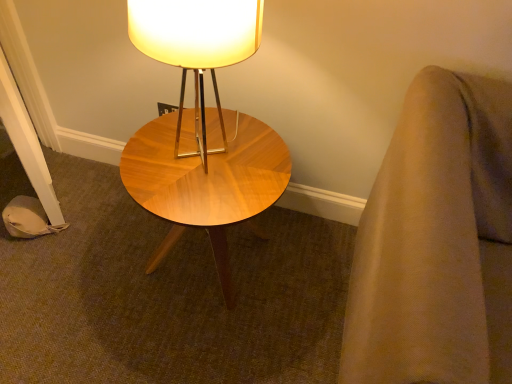
Question: Considering the relative sizes of wooden lampshade at center and woodenwoodencoffee table at center in the image provided, is wooden lampshade at center smaller than woodenwoodencoffee table at center?

Choices:
 (A) yes
 (B) no

Answer: (A)

Question: Is woodenwoodencoffee table at center located within wooden lampshade at center?

Choices:
 (A) yes
 (B) no

Answer: (B)

Question: Considering the relative sizes of wooden lampshade at center and woodenwoodencoffee table at center in the image provided, is wooden lampshade at center shorter than woodenwoodencoffee table at center?

Choices:
 (A) no
 (B) yes

Answer: (A)

Question: Is wooden lampshade at center with woodenwoodencoffee table at center?

Choices:
 (A) no
 (B) yes

Answer: (A)

Question: Is wooden lampshade at center not within woodenwoodencoffee table at center?

Choices:
 (A) yes
 (B) no

Answer: (A)

Question: Is wooden lampshade at center aimed at woodenwoodencoffee table at center?

Choices:
 (A) no
 (B) yes

Answer: (A)

Question: Is woodenwoodencoffee table at center shorter than wooden lampshade at center?

Choices:
 (A) no
 (B) yes

Answer: (B)

Question: From the image's perspective, is woodenwoodencoffee table at center beneath wooden lampshade at center?

Choices:
 (A) no
 (B) yes

Answer: (B)

Question: Is wooden lampshade at center located within woodenwoodencoffee table at center?

Choices:
 (A) yes
 (B) no

Answer: (B)

Question: From a real-world perspective, is woodenwoodencoffee table at center beneath wooden lampshade at center?

Choices:
 (A) yes
 (B) no

Answer: (A)

Question: Can you confirm if woodenwoodencoffee table at center is smaller than wooden lampshade at center?

Choices:
 (A) yes
 (B) no

Answer: (B)

Question: Is woodenwoodencoffee table at center behind wooden lampshade at center?

Choices:
 (A) yes
 (B) no

Answer: (A)

Question: From a real-world perspective, is wooden lampshade at center positioned above or below woodenwoodencoffee table at center?

Choices:
 (A) above
 (B) below

Answer: (A)